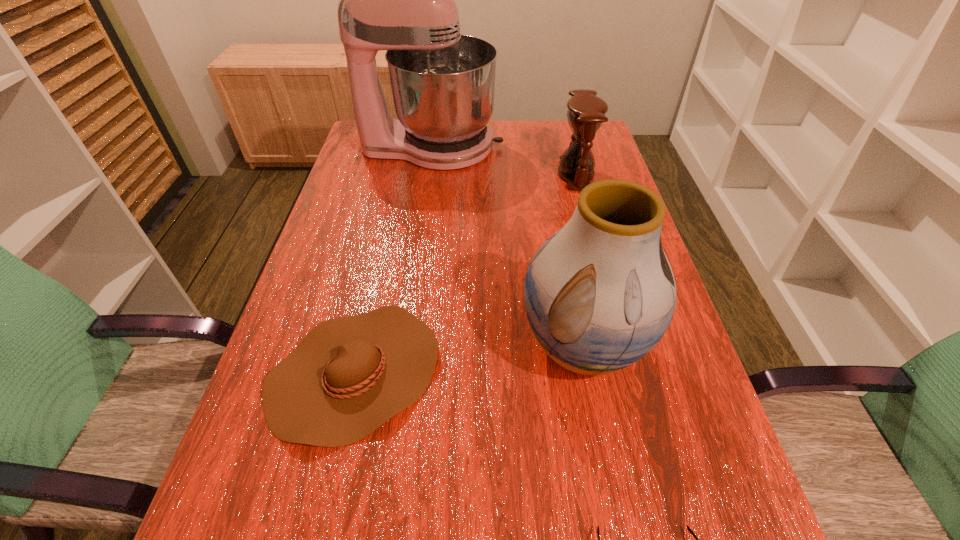
Find the location of a particular element. The image size is (960, 540). vacant space that's between the second shortest object and the tallest object is located at coordinates (394, 260).

This screenshot has height=540, width=960. What are the coordinates of `vacant space in between the tallest object and the vase` in the screenshot? It's located at (507, 247).

The height and width of the screenshot is (540, 960). I want to click on empty space that is in between the second shortest object and the mixer, so click(x=394, y=260).

Locate an element on the screen. This screenshot has height=540, width=960. vacant region between the mixer and the fourth shortest object is located at coordinates (507, 247).

Locate which object is the fourth closest to the fourth shortest object. Please provide its 2D coordinates. Your answer should be formatted as a tuple, i.e. [(x, y)], where the tuple contains the x and y coordinates of a point satisfying the conditions above.

[(402, 0)]

Identify which object is the fourth closest to the mixer. Please provide its 2D coordinates. Your answer should be formatted as a tuple, i.e. [(x, y)], where the tuple contains the x and y coordinates of a point satisfying the conditions above.

[(598, 532)]

In order to click on blank space that satisfies the following two spatial constraints: 1. on the back side of the cowboy hat; 2. on the right side of the third tallest object in this screenshot , I will do `click(400, 174)`.

Image resolution: width=960 pixels, height=540 pixels. I want to click on free region that satisfies the following two spatial constraints: 1. on the front-facing side of the fourth shortest object; 2. on the left side of the mixer, so click(403, 347).